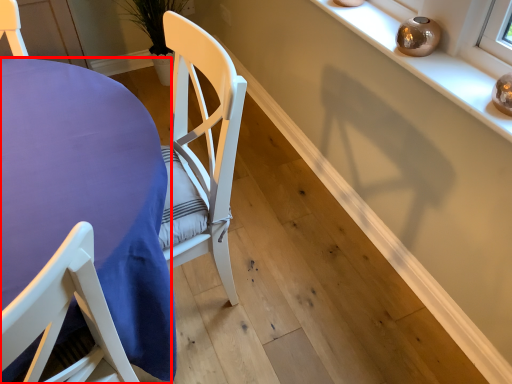
Question: From the image's perspective, where is table (annotated by the red box) located relative to shelf?

Choices:
 (A) above
 (B) below

Answer: (B)